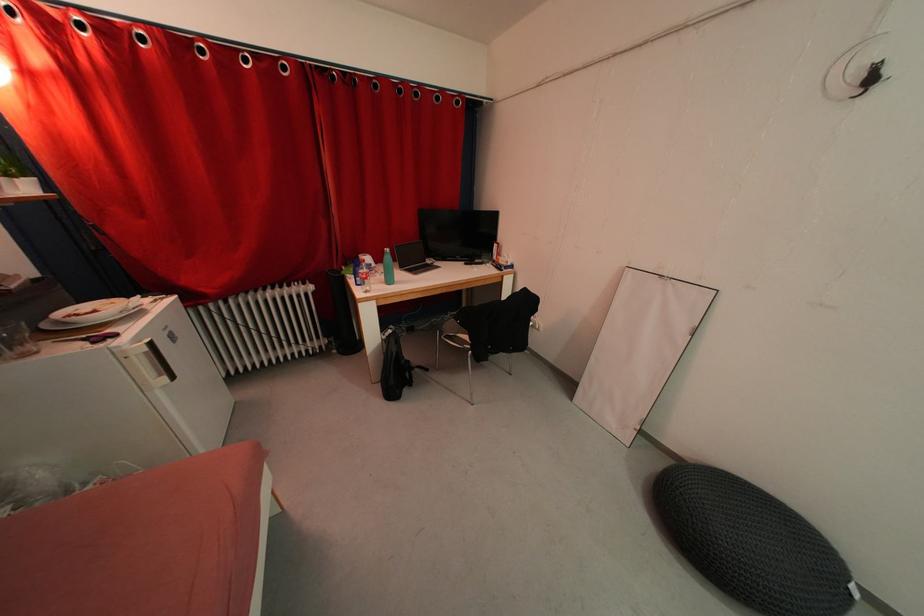
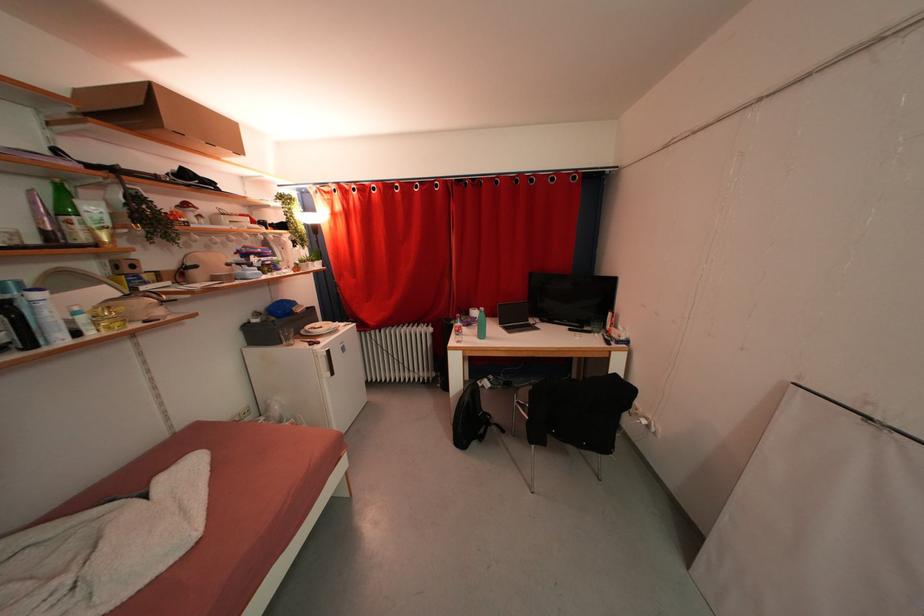
Where in the second image is the point corresponding to point 119,346 from the first image?

(322, 351)